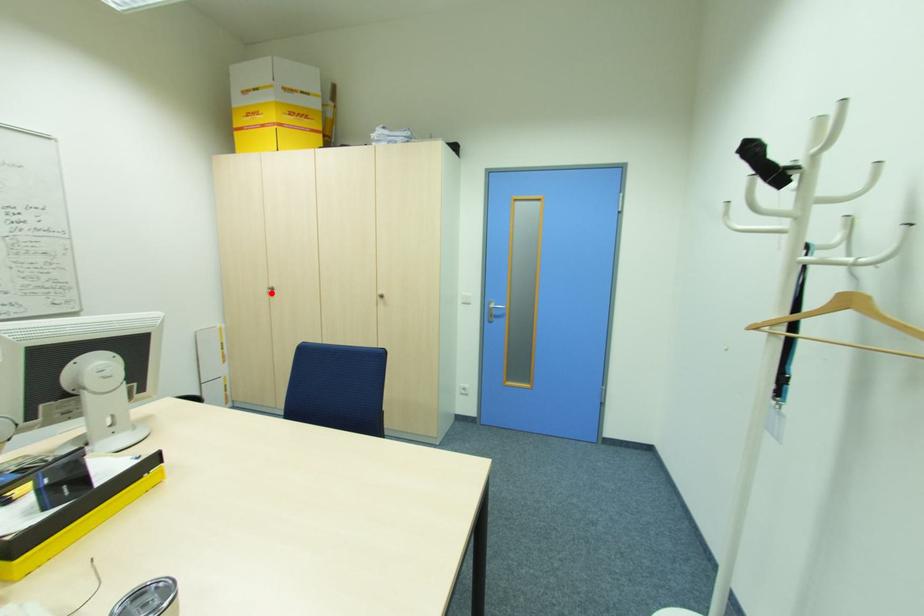
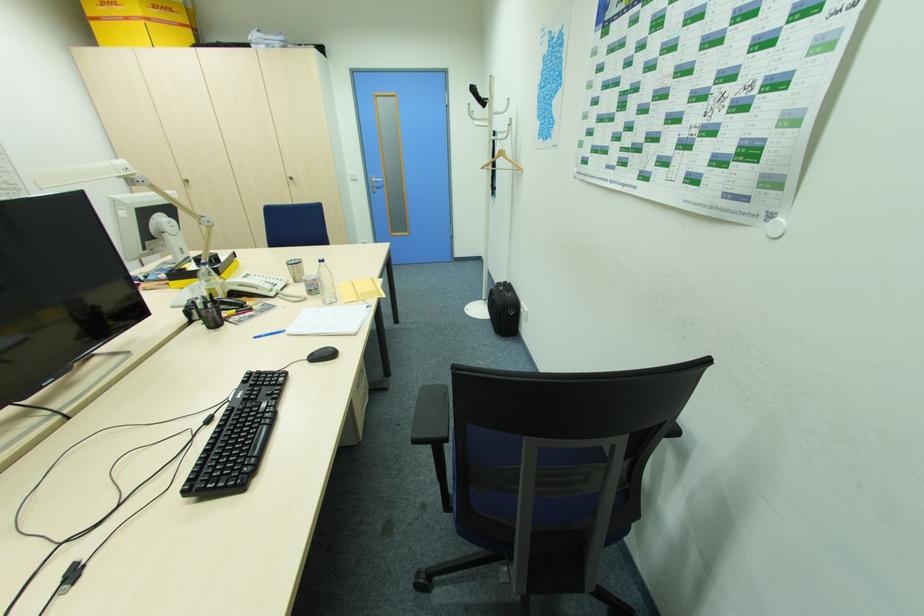
Question: I am providing you with two images of the same scene from different viewpoints. A red point is marked on the first image. Can you still see the location of the red point in image 2?

Choices:
 (A) Yes
 (B) No

Answer: (A)